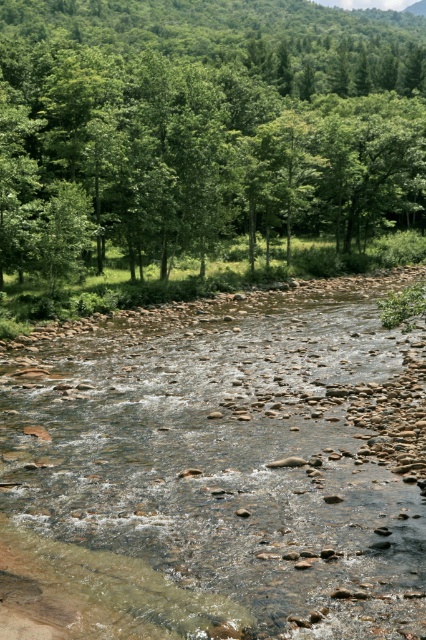
You are standing at the edge of the river and want to cross it to reach the green leafy tree at upper center. Given that your boat can only carry a maximum width of 2 meters, will the clear water at center allow you to cross safely?

The clear water at center has a width less than the green leafy tree at upper center, but the exact width isn

You are standing at the edge of the river and notice the clear water at center and the green leafy tree at upper center. Which one appears to be larger in size?

The green leafy tree at upper center is larger than the clear water at center.

You are a hiker who wants to cross the river at the clear water at center. However, you notice the green leafy tree at upper center overhead. Do you think the tree might block your path when you try to cross the river?

The clear water at center is positioned under the green leafy tree at upper center, so the tree branches might block your path when crossing the river.